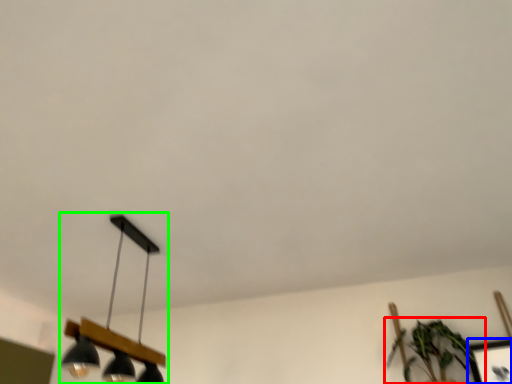
Question: Based on their relative distances, which object is farther from houseplant (highlighted by a red box)? Choose from picture frame (highlighted by a blue box) and lamp (highlighted by a green box).

Choices:
 (A) picture frame
 (B) lamp

Answer: (B)